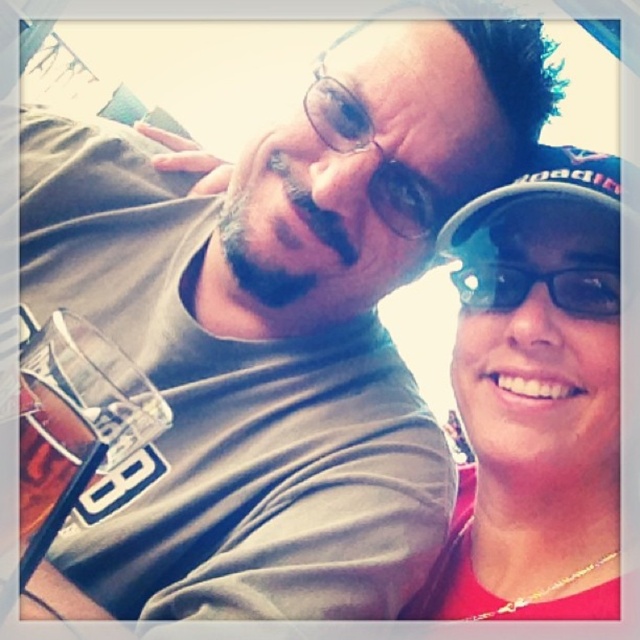
Question: Which object is the farthest from the dark brown stubble at center?

Choices:
 (A) black fabric baseball cap at upper right
 (B) matte black glasses at center

Answer: (A)

Question: Where is transparent plastic goggles at upper right located in relation to dark brown stubble at center in the image?

Choices:
 (A) below
 (B) above

Answer: (A)

Question: Is matte black glasses at center wider than dark brown stubble at center?

Choices:
 (A) no
 (B) yes

Answer: (B)

Question: Does matte black cap at right appear on the left side of transparent plastic goggles at upper right?

Choices:
 (A) no
 (B) yes

Answer: (A)

Question: Which object appears closest to the camera in this image?

Choices:
 (A) black fabric baseball cap at upper right
 (B) matte black cap at right
 (C) dark brown stubble at center
 (D) transparent plastic goggles at upper right

Answer: (A)

Question: Which of the following is the farthest from the observer?

Choices:
 (A) transparent plastic goggles at upper right
 (B) black fabric baseball cap at upper right
 (C) dark brown stubble at center
 (D) matte black glasses at center

Answer: (D)